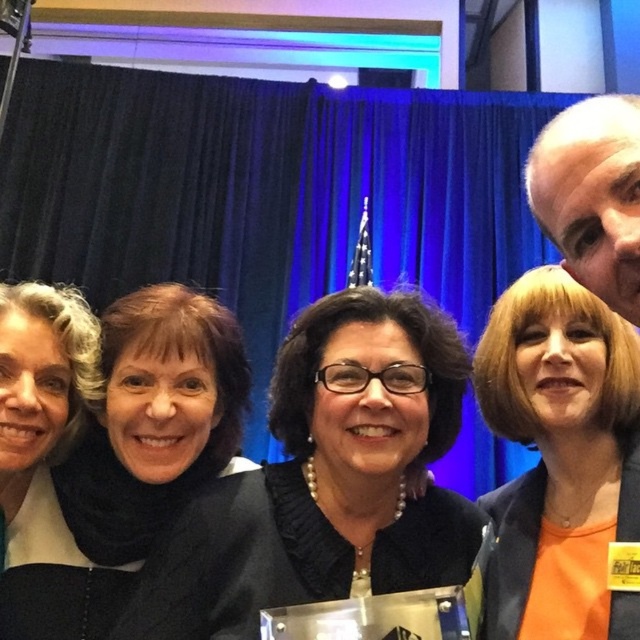
You are a photographer adjusting the camera focus. You need to ensure both the black matte scarf at upper left and the matte black jacket at left are in focus. Which object should you adjust the focus on first to account for their size difference?

The black matte scarf at upper left is larger in size than the matte black jacket at left, so you should focus on the black matte scarf at upper left first to ensure its larger details are sharp before adjusting for the smaller jacket.

Looking at this image, you are a photographer adjusting the camera settings for a group photo. You notice the black matte scarf at upper left and the matte black jacket at left in your frame. Which object should you focus on first if you want to ensure both are in focus, considering their sizes?

The black matte scarf at upper left has a larger width than the matte black jacket at left, so focusing on the larger object first would help ensure both are in focus.

You are a photographer adjusting your camera settings to capture the group photo. You notice the black pearl necklace at center and the matte black jacket at left. Which object appears smaller in height when viewed from your current position?

The black pearl necklace at center appears smaller in height than the matte black jacket at left because it is not as tall.